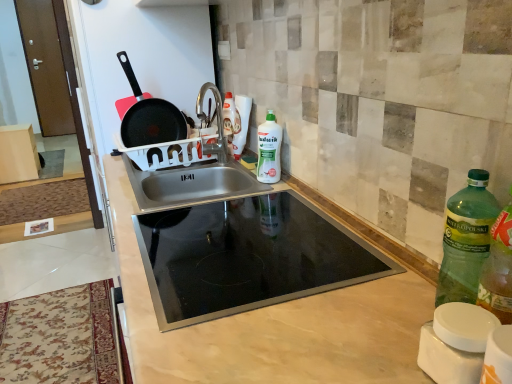
Question: Considering the relative sizes of stainless steel sink at center and green matte bottle at center, positioned as the first bottle in back-to-front order, in the image provided, is stainless steel sink at center smaller than green matte bottle at center, positioned as the first bottle in back-to-front order,?

Choices:
 (A) no
 (B) yes

Answer: (A)

Question: From a real-world perspective, is stainless steel sink at center beneath green matte bottle at center, the 2th bottle viewed from the right?

Choices:
 (A) no
 (B) yes

Answer: (B)

Question: Would you say stainless steel sink at center is outside green matte bottle at center, the 1th bottle viewed from the left?

Choices:
 (A) no
 (B) yes

Answer: (B)

Question: From the image's perspective, is stainless steel sink at center located above green matte bottle at center, the 1th bottle viewed from the left?

Choices:
 (A) yes
 (B) no

Answer: (B)

Question: Can you confirm if stainless steel sink at center is wider than green matte bottle at center, positioned as the first bottle in back-to-front order?

Choices:
 (A) no
 (B) yes

Answer: (B)

Question: Is stainless steel sink at center to the left of green matte bottle at center, positioned as the first bottle in back-to-front order, from the viewer's perspective?

Choices:
 (A) no
 (B) yes

Answer: (B)

Question: Is green plastic bottle at right, marked as the 1th bottle in a bottom-to-top arrangement, bigger than beige marble countertop at center?

Choices:
 (A) yes
 (B) no

Answer: (B)

Question: Considering the relative sizes of green plastic bottle at right, which is counted as the 2th bottle, starting from the back, and beige marble countertop at center in the image provided, is green plastic bottle at right, which is counted as the 2th bottle, starting from the back, shorter than beige marble countertop at center?

Choices:
 (A) no
 (B) yes

Answer: (B)

Question: Is beige marble countertop at center a part of green plastic bottle at right, which is counted as the 2th bottle, starting from the back?

Choices:
 (A) yes
 (B) no

Answer: (B)

Question: From the image's perspective, does green plastic bottle at right, positioned as the first bottle in front-to-back order, appear lower than beige marble countertop at center?

Choices:
 (A) no
 (B) yes

Answer: (A)

Question: From a real-world perspective, does green plastic bottle at right, placed as the second bottle when sorted from left to right, stand above beige marble countertop at center?

Choices:
 (A) yes
 (B) no

Answer: (A)

Question: Is green plastic bottle at right, placed as the second bottle when sorted from left to right, closer to the viewer compared to beige marble countertop at center?

Choices:
 (A) no
 (B) yes

Answer: (B)

Question: Would you say black non-stick frying pan at upper left is outside green matte bottle at center, marked as the 1th bottle in a top-to-bottom arrangement?

Choices:
 (A) yes
 (B) no

Answer: (A)